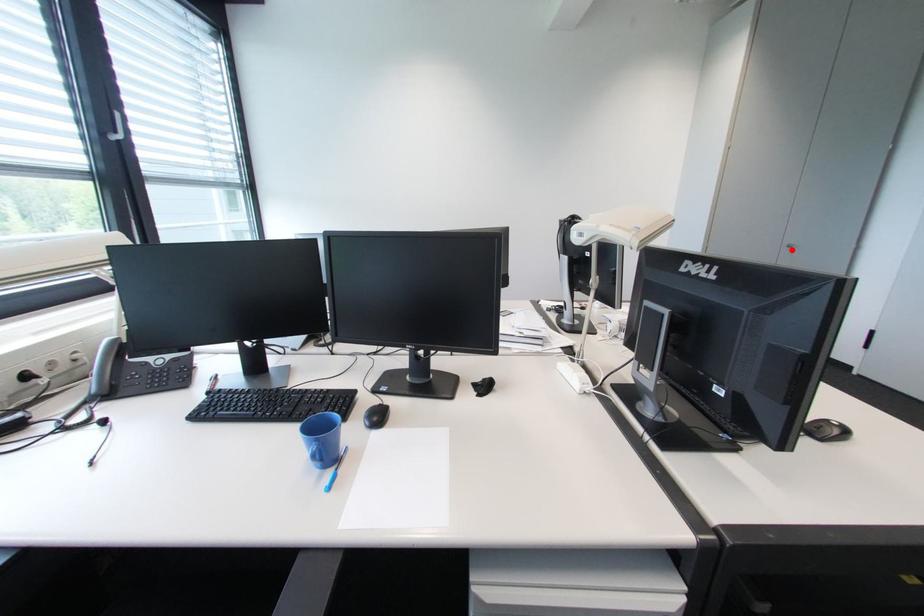
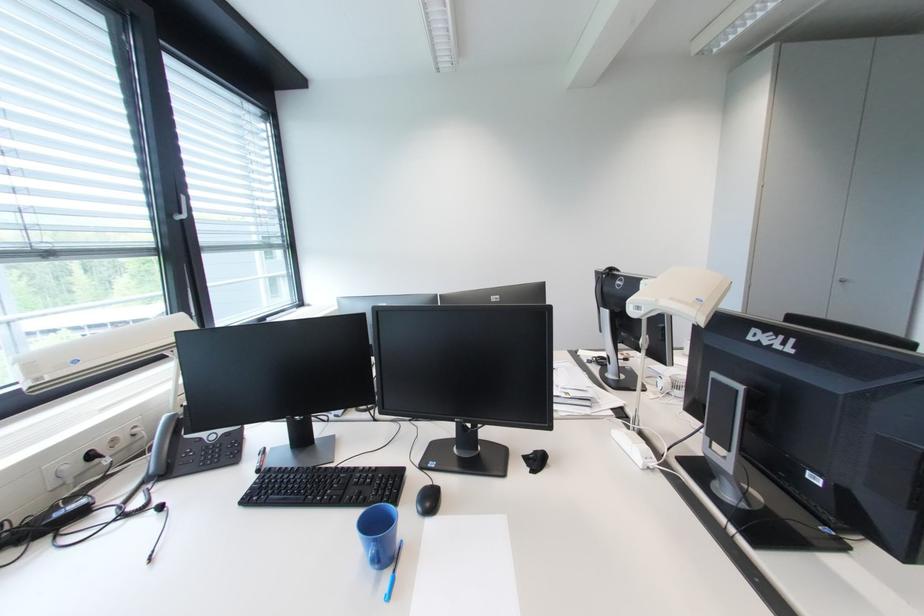
The point at the highlighted location is marked in the first image. Where is the corresponding point in the second image?

(844, 285)